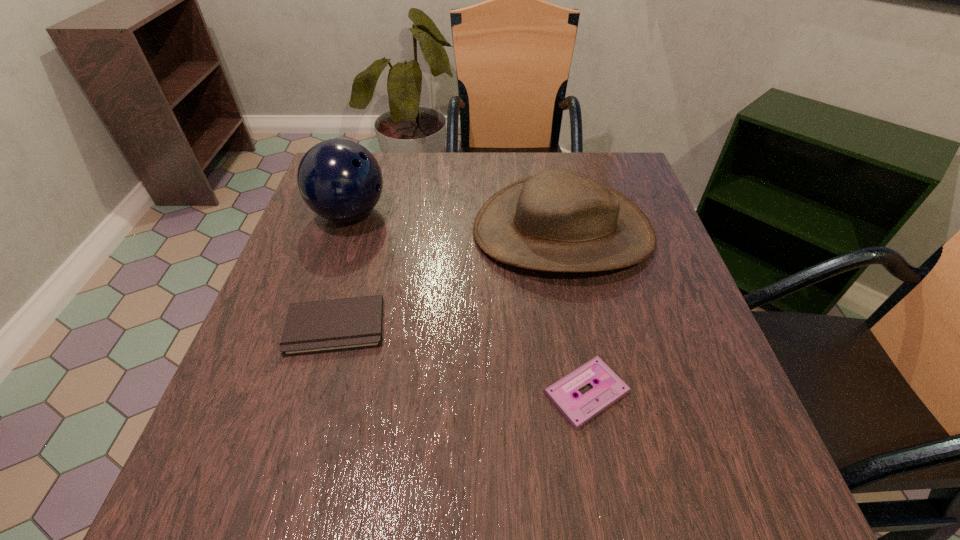
At what (x,y) coordinates should I click in order to perform the action: click on the tallest object. Please return your answer as a coordinate pair (x, y). The width and height of the screenshot is (960, 540). Looking at the image, I should click on (340, 180).

The height and width of the screenshot is (540, 960). I want to click on cowboy hat, so click(x=558, y=220).

At what (x,y) coordinates should I click in order to perform the action: click on the second nearest object. Please return your answer as a coordinate pair (x, y). Looking at the image, I should click on pyautogui.click(x=322, y=326).

In order to click on the third tallest object in this screenshot , I will do `click(322, 326)`.

Locate an element on the screen. Image resolution: width=960 pixels, height=540 pixels. the shortest object is located at coordinates (609, 388).

Locate an element on the screen. videotape is located at coordinates (609, 388).

Find the location of a particular element. The height and width of the screenshot is (540, 960). vacant space located 0.220m on the surface of the bowling ball near the finger holes is located at coordinates (481, 214).

What are the coordinates of `free space located on the left of the cowboy hat` in the screenshot? It's located at (450, 232).

Locate an element on the screen. The image size is (960, 540). vacant space located on the front of the checkbook is located at coordinates (299, 454).

Identify the location of free location located 0.190m on the left of the shortest object. (427, 393).